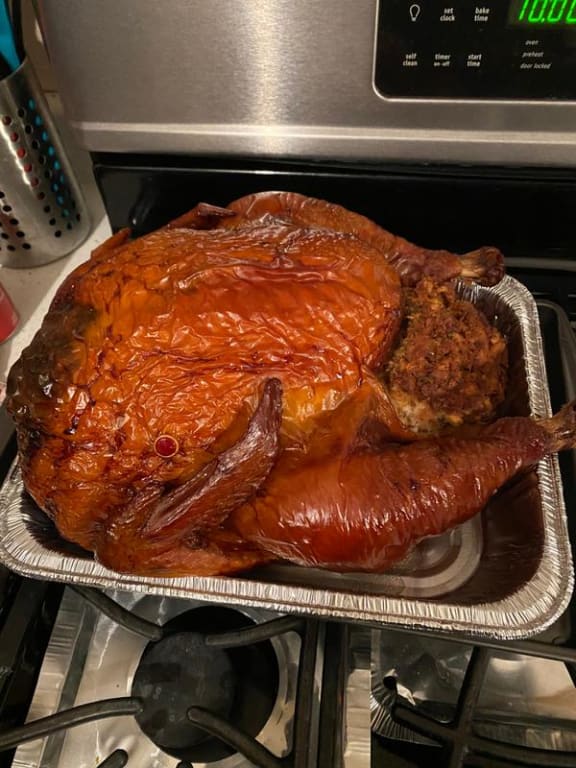
Where is `grate`? This screenshot has height=768, width=576. grate is located at coordinates (454, 723), (195, 716), (98, 699), (103, 590), (242, 630).